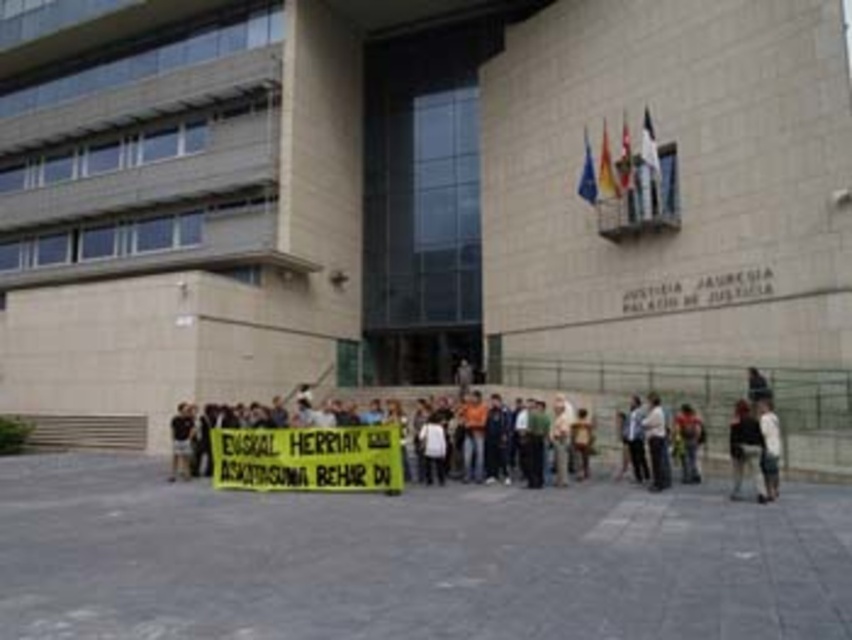
You are a photographer standing at the front of the building and want to capture a photo of the dark gray fabric jacket at lower right and the white cotton shirt at lower right in the same frame. The camera has a minimum focusing distance of 1.5 meters. Can you take the photo without moving closer?

The distance between the dark gray fabric jacket at lower right and the white cotton shirt at lower right is 1.20 meters. Since the camera requires a minimum focusing distance of 1.5 meters, you can take the photo without moving closer because the subjects are within the camera range.

You are a photographer standing in front of the courthouse. You notice two people wearing dark gray clothing. One has a dark gray fabric jacket at lower right and the other has dark gray pants at center. Which clothing item is positioned lower in the image?

The dark gray fabric jacket at lower right is located below the dark gray pants at center, so the jacket is positioned lower in the image.

You are a photographer trying to capture a photo of the dark gray pants at center and the white cotton shirt at lower right. Which object should you focus on first if you want to ensure both are in focus, considering their sizes?

The dark gray pants at center is larger in size than the white cotton shirt at lower right, so you should focus on the dark gray pants at center first to ensure both are in focus.